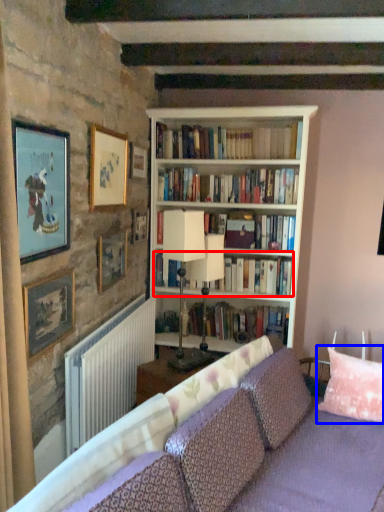
Question: Which point is closer to the camera, book (highlighted by a red box) or pillow (highlighted by a blue box)?

Choices:
 (A) book
 (B) pillow

Answer: (B)